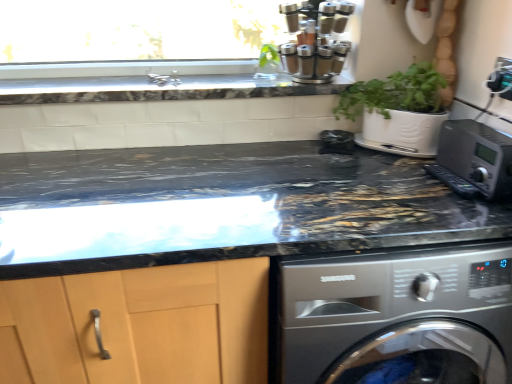
Image resolution: width=512 pixels, height=384 pixels. I want to click on free spot in front of green leafy plant at upper center, so [x=266, y=82].